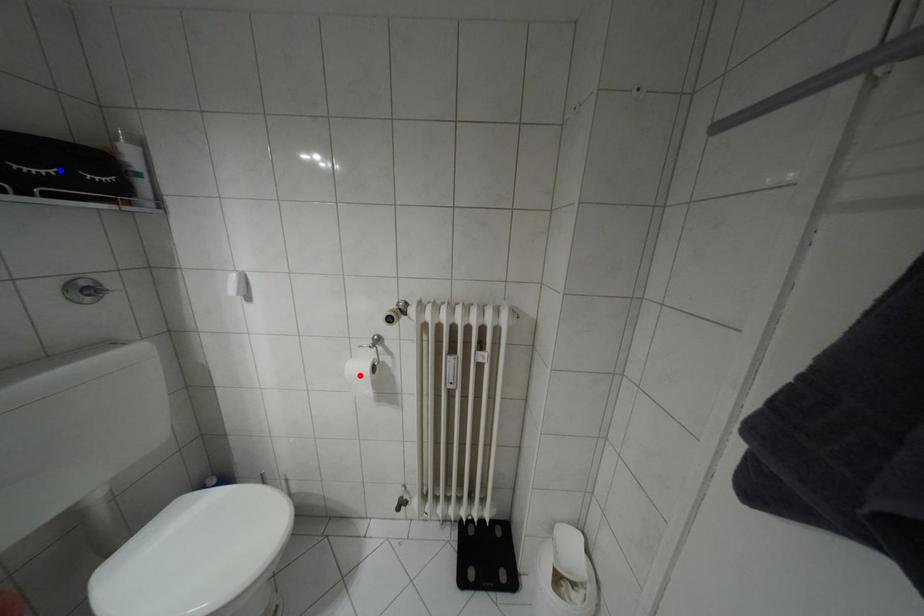
Question: Which of the two points in the image is closer to the camera?

Choices:
 (A) Blue point is closer.
 (B) Red point is closer.

Answer: (A)